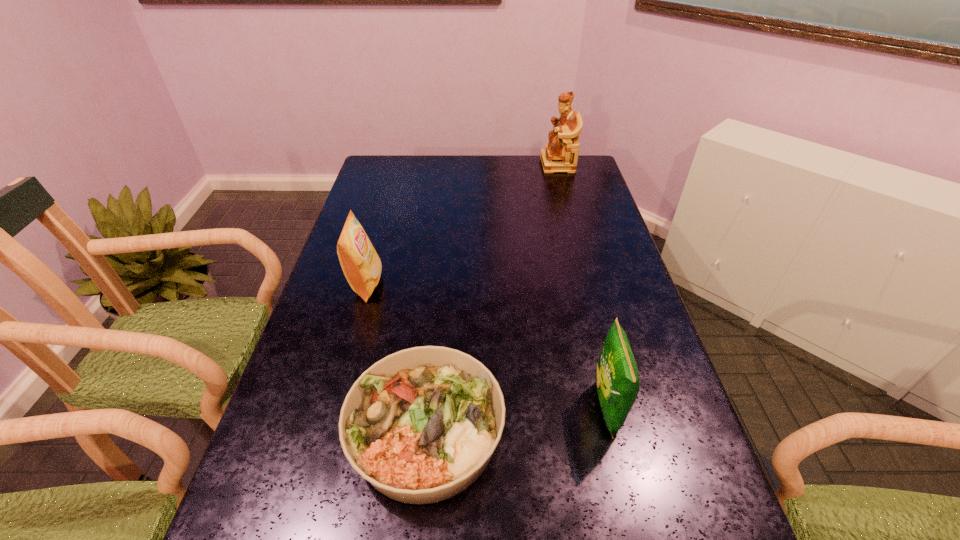
In the image, there is a desktop. Where is `free region at the far edge`? free region at the far edge is located at coordinates (435, 178).

Where is `blank space at the left edge`? blank space at the left edge is located at coordinates (259, 457).

The image size is (960, 540). In the image, there is a desktop. What are the coordinates of `vacant space at the right edge` in the screenshot? It's located at (570, 224).

Identify the location of vacant space at the far left corner of the desktop. This screenshot has height=540, width=960. (383, 185).

Where is `unoccupied area between the tallest object and the salad plate`? This screenshot has width=960, height=540. unoccupied area between the tallest object and the salad plate is located at coordinates (492, 298).

At what (x,y) coordinates should I click in order to perform the action: click on vacant space that's between the tallest object and the shortest object. Please return your answer as a coordinate pair (x, y). Looking at the image, I should click on (492, 298).

Locate an element on the screen. The width and height of the screenshot is (960, 540). free space that is in between the tallest object and the third object from right to left is located at coordinates (492, 298).

This screenshot has width=960, height=540. What are the coordinates of `free spot between the figurine and the right crisp (potato chip)` in the screenshot? It's located at (582, 286).

The image size is (960, 540). What are the coordinates of `free point between the farthest object and the second farthest object` in the screenshot? It's located at tap(462, 224).

What are the coordinates of `free spot between the leftmost object and the nearer crisp (potato chip)` in the screenshot? It's located at (487, 346).